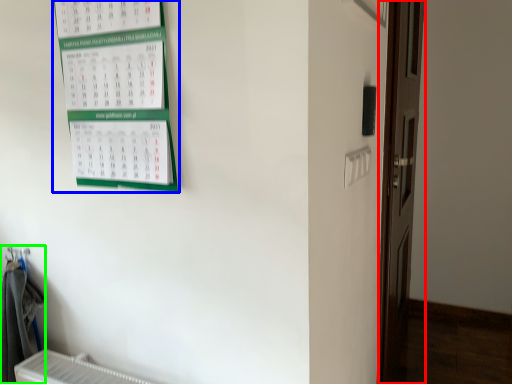
Question: Based on their relative distances, which object is nearer to door (highlighted by a red box)? Choose from bulletin board (highlighted by a blue box) and laundry (highlighted by a green box).

Choices:
 (A) bulletin board
 (B) laundry

Answer: (A)